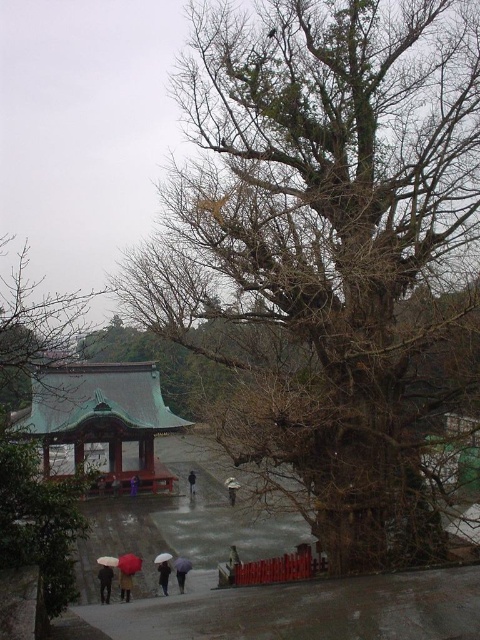
Is green leafy tree at center further to the viewer compared to bronze/golden gazebo at lower left?

No, green leafy tree at center is closer to the viewer.

Is green leafy tree at center closer to camera compared to bronze/golden gazebo at lower left?

That is True.

What do you see at coordinates (35, 444) in the screenshot?
I see `green leafy tree at center` at bounding box center [35, 444].

This screenshot has width=480, height=640. Identify the location of green leafy tree at center. (35, 444).

Is point (224, 150) positioned after point (228, 484)?

No, it is not.

Between bare wood tree at center and matte black umbrella at center, which one has more height?

bare wood tree at center

Between point (309, 90) and point (237, 483), which one is positioned behind?

The point (237, 483) is behind.

The width and height of the screenshot is (480, 640). I want to click on bare wood tree at center, so click(328, 252).

Does matte black umbrella at lower left come in front of white matte umbrella at lower center?

Yes, matte black umbrella at lower left is closer to the viewer.

Which is behind, point (100, 561) or point (168, 557)?

The point (168, 557) is behind.

This screenshot has width=480, height=640. In order to click on matte black umbrella at lower left in this screenshot , I will do `click(108, 561)`.